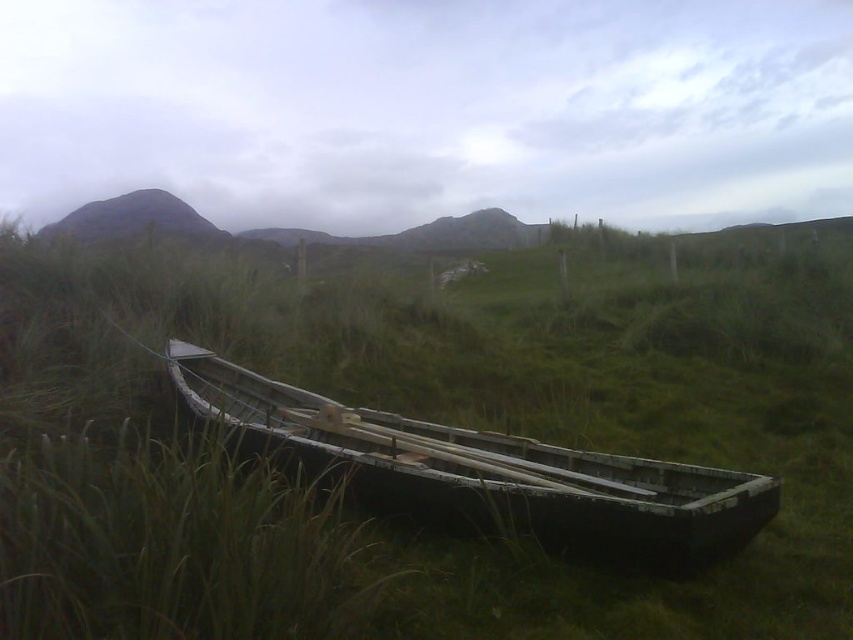
Question: Which point appears farthest from the camera in this image?

Choices:
 (A) (416, 470)
 (B) (834, 342)

Answer: (B)

Question: Is green matte grass at center thinner than dark gray wooden boat at center?

Choices:
 (A) no
 (B) yes

Answer: (A)

Question: Which object is farther from the camera taking this photo?

Choices:
 (A) green matte grass at center
 (B) dark gray wooden boat at center

Answer: (B)

Question: Is the position of green matte grass at center more distant than that of dark gray wooden boat at center?

Choices:
 (A) no
 (B) yes

Answer: (A)

Question: Does green matte grass at center have a lesser width compared to dark gray wooden boat at center?

Choices:
 (A) yes
 (B) no

Answer: (B)